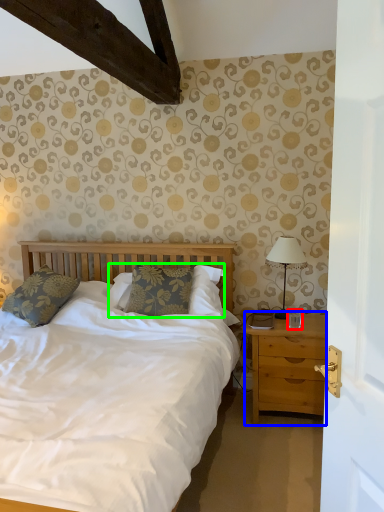
Question: Which is farther away from coffee cup (highlighted by a red box)? nightstand (highlighted by a blue box) or pillow (highlighted by a green box)?

Choices:
 (A) nightstand
 (B) pillow

Answer: (B)